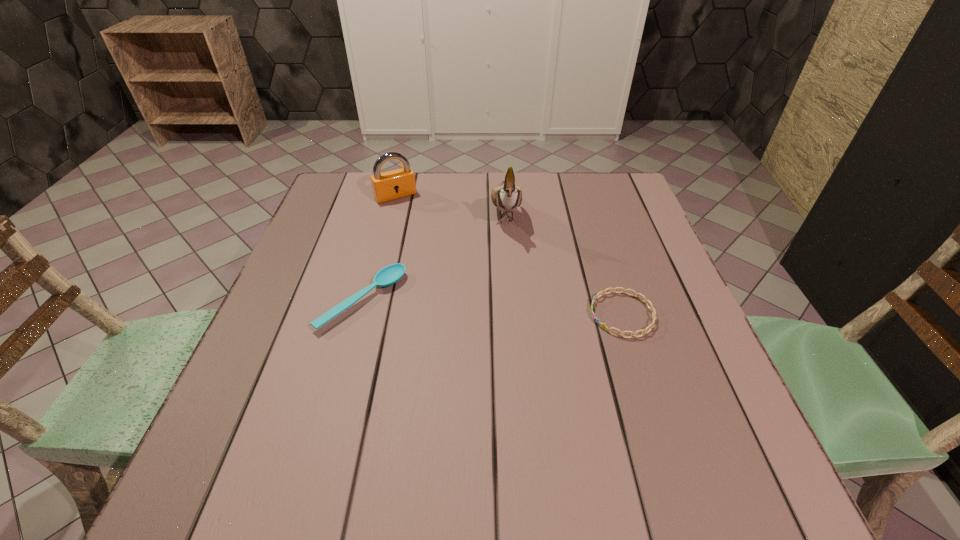
Find the location of a particular element. The height and width of the screenshot is (540, 960). free spot on the desktop that is between the spoon and the bracelet and is positioned at the face of the third object from left to right is located at coordinates (514, 308).

The image size is (960, 540). In order to click on free space on the desktop that is between the spoon and the bracelet and is positioned to unlock the padlock from the front in this screenshot , I will do `click(468, 306)`.